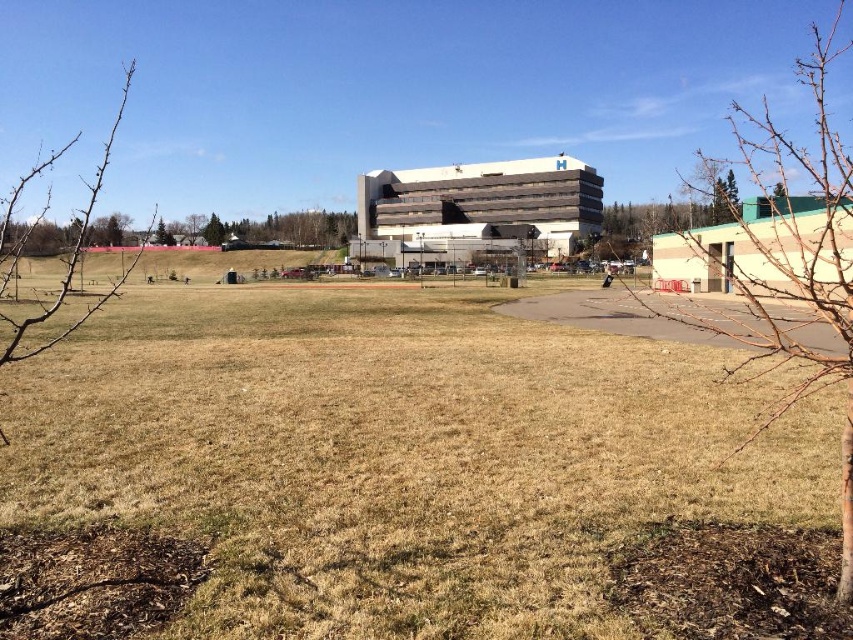
Question: Estimate the real-world distances between objects in this image. Which object is closer to the green leafy tree at upper left?

Choices:
 (A) bare branches at upper left
 (B) white concrete building at center
 (C) brown dry grass at center

Answer: (A)

Question: Which point appears farthest from the camera in this image?

Choices:
 (A) pyautogui.click(x=786, y=323)
 (B) pyautogui.click(x=526, y=205)
 (C) pyautogui.click(x=73, y=356)

Answer: (B)

Question: Can you confirm if brown dry grass at center is bigger than white concrete building at center?

Choices:
 (A) no
 (B) yes

Answer: (A)

Question: Considering the real-world distances, which object is farthest from the green leafy tree at upper left?

Choices:
 (A) white concrete building at center
 (B) bare branches at upper left

Answer: (A)

Question: Does bare branches at lower right come behind white concrete building at center?

Choices:
 (A) yes
 (B) no

Answer: (B)

Question: Does brown dry grass at center have a larger size compared to bare branches at upper left?

Choices:
 (A) yes
 (B) no

Answer: (B)